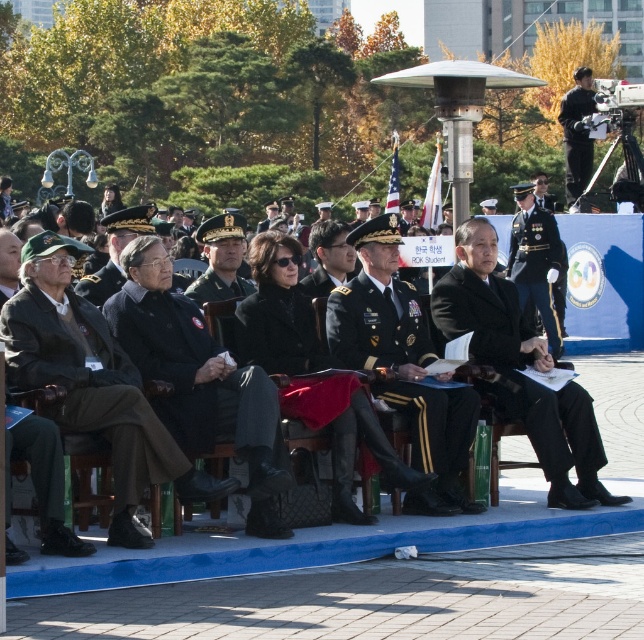
Question: In this image, where is black matte suit at center located relative to black matte uniform at upper right?

Choices:
 (A) right
 (B) left

Answer: (B)

Question: Can you confirm if shiny black uniform at center is positioned above black matte uniform at upper right?

Choices:
 (A) no
 (B) yes

Answer: (A)

Question: Which object appears closest to the camera in this image?

Choices:
 (A) dark brown wool coat at center
 (B) dark gray uniform at center
 (C) black matte uniform at upper right

Answer: (A)

Question: Which point appears closest to the camera in this image?

Choices:
 (A) (553, 481)
 (B) (137, 465)
 (C) (401, 285)

Answer: (B)

Question: Is dark brown wool coat at center above black matte suit at center?

Choices:
 (A) yes
 (B) no

Answer: (B)

Question: Which point is farther from the camera taking this photo?

Choices:
 (A) (126, 481)
 (B) (542, 348)
 (C) (529, 240)

Answer: (C)